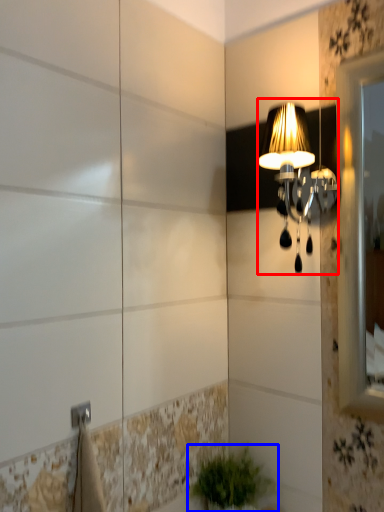
Question: Which object appears closest to the camera in this image, lamp (highlighted by a red box) or houseplant (highlighted by a blue box)?

Choices:
 (A) lamp
 (B) houseplant

Answer: (A)